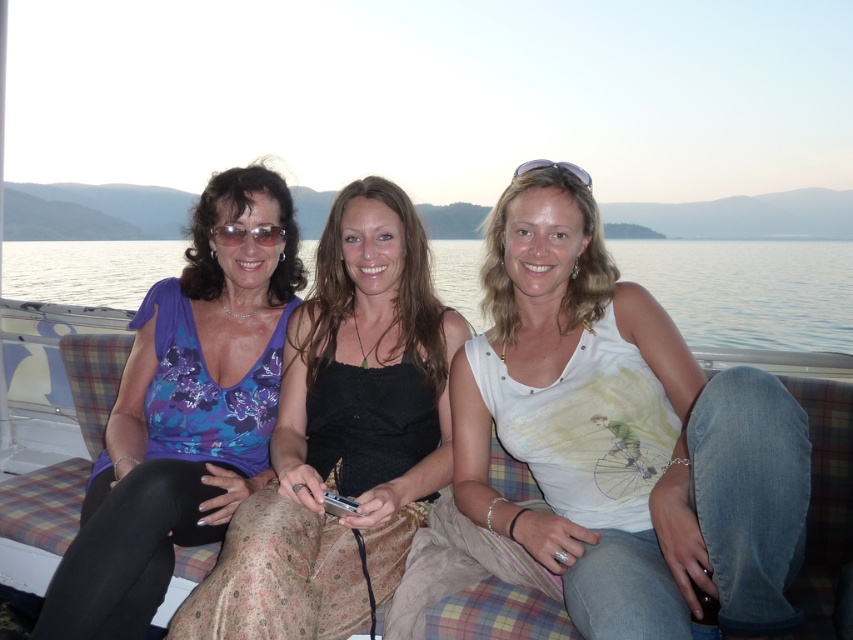
Is floral print tank top at center smaller than clear blue water at center?

Yes.

Between point (393, 417) and point (680, 285), which one is positioned behind?

Point (680, 285)

Find the location of a particular element. floral print tank top at center is located at coordinates (341, 435).

Is matte purple blouse at left below clear blue water at center?

Indeed, matte purple blouse at left is positioned under clear blue water at center.

Where is `matte purple blouse at left`? matte purple blouse at left is located at coordinates tap(184, 413).

Identify the location of matte purple blouse at left. (184, 413).

I want to click on matte purple blouse at left, so point(184,413).

This screenshot has height=640, width=853. What do you see at coordinates (747, 289) in the screenshot?
I see `clear blue water at center` at bounding box center [747, 289].

At what (x,y) coordinates should I click in order to perform the action: click on clear blue water at center. Please return your answer as a coordinate pair (x, y). Image resolution: width=853 pixels, height=640 pixels. Looking at the image, I should click on click(x=747, y=289).

Locate an element on the screen. clear blue water at center is located at coordinates (747, 289).